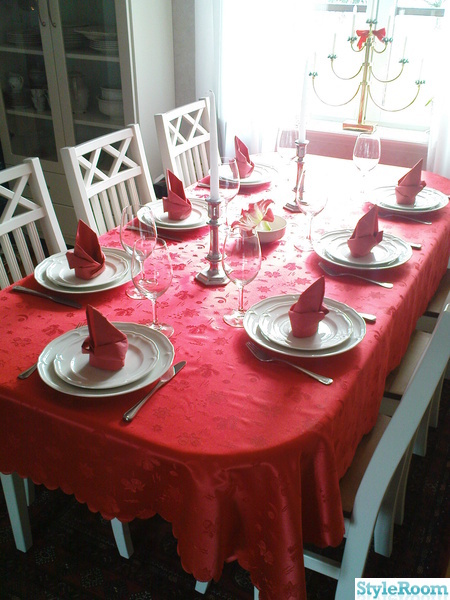
Where is `large dinner plate`? Image resolution: width=450 pixels, height=600 pixels. large dinner plate is located at coordinates (163, 359), (252, 321), (326, 238), (443, 201), (273, 173), (156, 204), (127, 277).